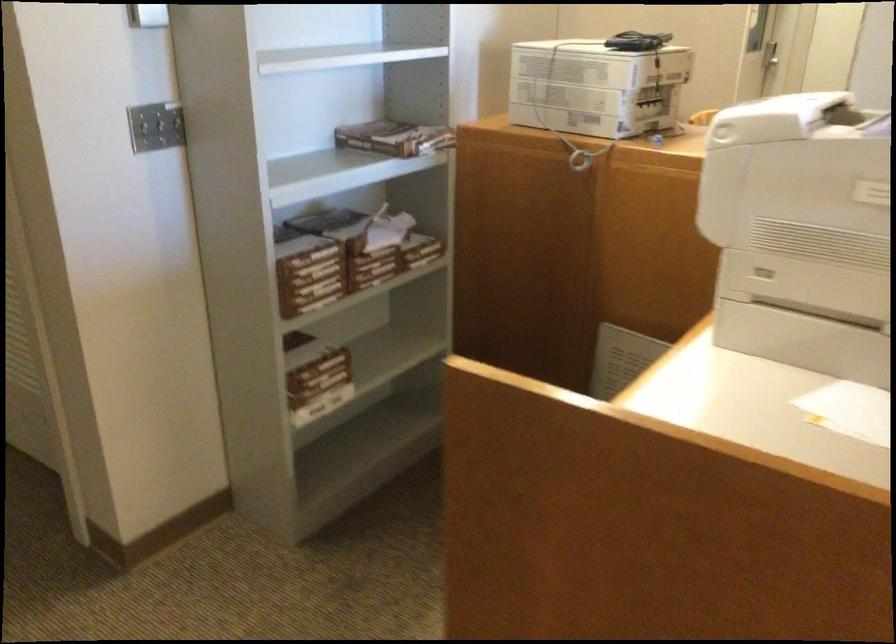
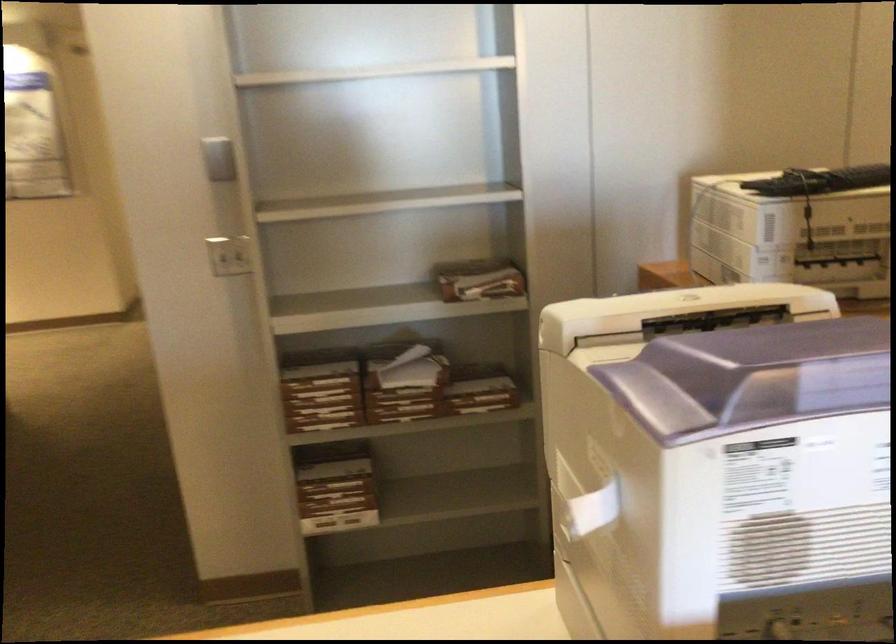
In the second image, find the point that corresponds to the point at 323,366 in the first image.

(334, 488)